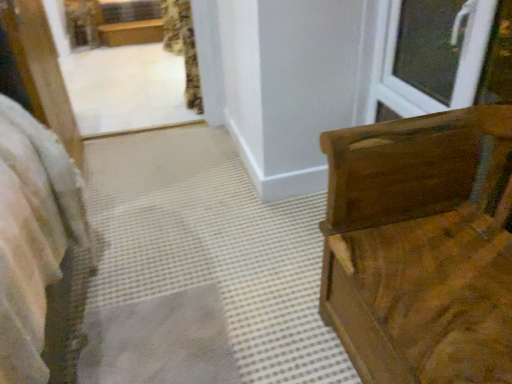
Question: From the image's perspective, does wooden chest at right appear higher than white plastic window at upper right?

Choices:
 (A) yes
 (B) no

Answer: (B)

Question: From a real-world perspective, is wooden chest at right below white plastic window at upper right?

Choices:
 (A) no
 (B) yes

Answer: (B)

Question: Is wooden chest at right bigger than white plastic window at upper right?

Choices:
 (A) no
 (B) yes

Answer: (B)

Question: Considering the relative positions of wooden chest at right and white plastic window at upper right in the image provided, is wooden chest at right to the right of white plastic window at upper right from the viewer's perspective?

Choices:
 (A) yes
 (B) no

Answer: (B)

Question: Is wooden chest at right next to white plastic window at upper right and touching it?

Choices:
 (A) no
 (B) yes

Answer: (A)

Question: Is the depth of wooden chest at right greater than that of white plastic window at upper right?

Choices:
 (A) yes
 (B) no

Answer: (B)

Question: Does white plastic window at upper right turn towards wooden chest at right?

Choices:
 (A) yes
 (B) no

Answer: (B)

Question: Considering the relative sizes of white plastic window at upper right and wooden chest at right in the image provided, is white plastic window at upper right smaller than wooden chest at right?

Choices:
 (A) yes
 (B) no

Answer: (A)

Question: Does white plastic window at upper right come behind wooden chest at right?

Choices:
 (A) no
 (B) yes

Answer: (B)

Question: Considering the relative sizes of white plastic window at upper right and wooden chest at right in the image provided, is white plastic window at upper right shorter than wooden chest at right?

Choices:
 (A) no
 (B) yes

Answer: (B)

Question: Can you confirm if white plastic window at upper right is positioned to the right of wooden chest at right?

Choices:
 (A) yes
 (B) no

Answer: (A)

Question: Is wooden chest at right located within white plastic window at upper right?

Choices:
 (A) yes
 (B) no

Answer: (B)

Question: Could floral fabric curtain at upper center be considered to be inside white plastic window at upper right?

Choices:
 (A) yes
 (B) no

Answer: (B)